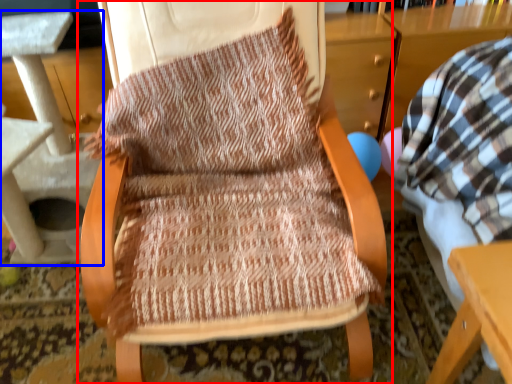
Question: Which point is further to the camera, chair (highlighted by a red box) or table (highlighted by a blue box)?

Choices:
 (A) chair
 (B) table

Answer: (B)